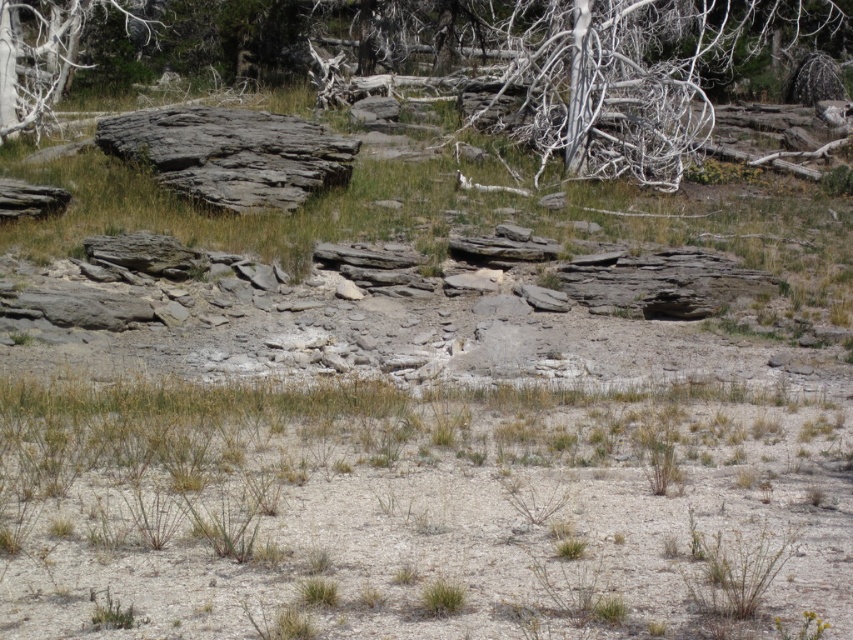
Based on the photo, between white bark tree at upper center and gray bark tree at upper left, which one has more height?

white bark tree at upper center is taller.

Who is positioned more to the left, white bark tree at upper center or gray bark tree at upper left?

Positioned to the left is gray bark tree at upper left.

Does point (753, 44) lie in front of point (12, 116)?

No.

Where is `white bark tree at upper center`? The height and width of the screenshot is (640, 853). white bark tree at upper center is located at coordinates (630, 76).

How distant is dry grass at lower center from white bark tree at upper center?

20.88 meters

Is point (666, 563) farther from viewer compared to point (635, 154)?

No, (666, 563) is in front of (635, 154).

Where is `dry grass at lower center`? This screenshot has width=853, height=640. dry grass at lower center is located at coordinates (415, 513).

The height and width of the screenshot is (640, 853). What are the coordinates of `dry grass at lower center` in the screenshot? It's located at (415, 513).

Does dry grass at lower center have a smaller size compared to gray bark tree at upper left?

Indeed, dry grass at lower center has a smaller size compared to gray bark tree at upper left.

Is point (418, 416) in front of point (61, 19)?

Yes, it is.

Image resolution: width=853 pixels, height=640 pixels. What do you see at coordinates (415, 513) in the screenshot?
I see `dry grass at lower center` at bounding box center [415, 513].

At what (x,y) coordinates should I click in order to perform the action: click on dry grass at lower center. Please return your answer as a coordinate pair (x, y). Looking at the image, I should click on (415, 513).